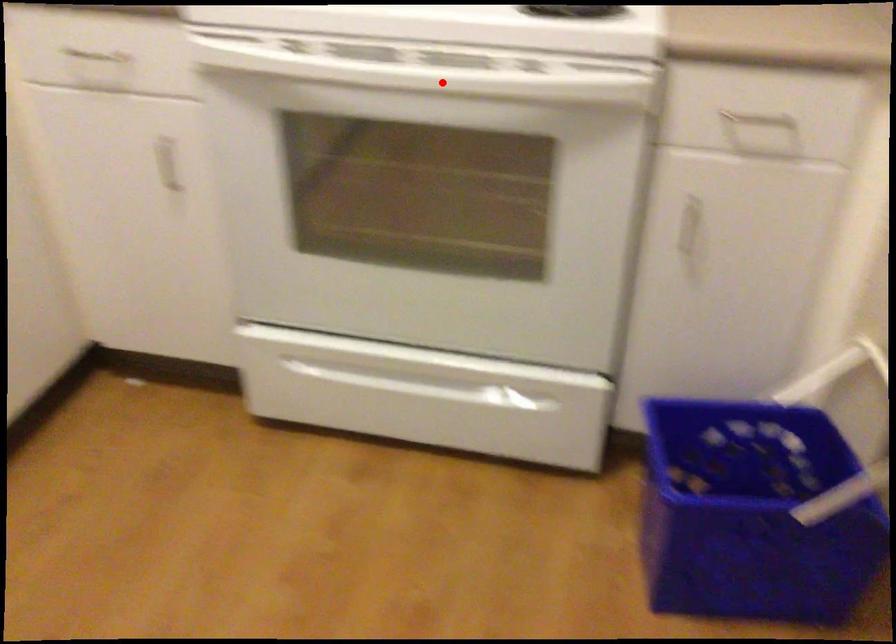
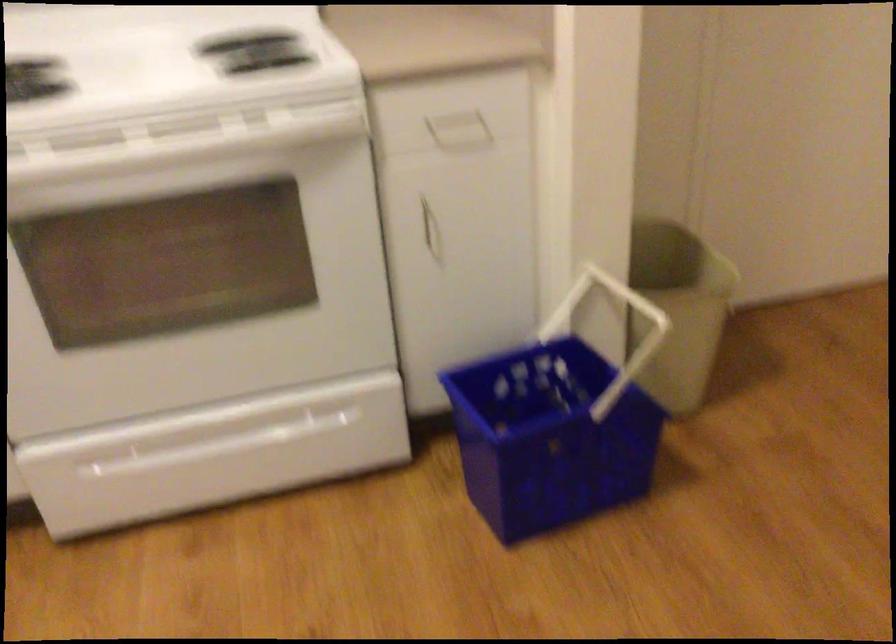
The point at the highlighted location is marked in the first image. Where is the corresponding point in the second image?

(175, 143)